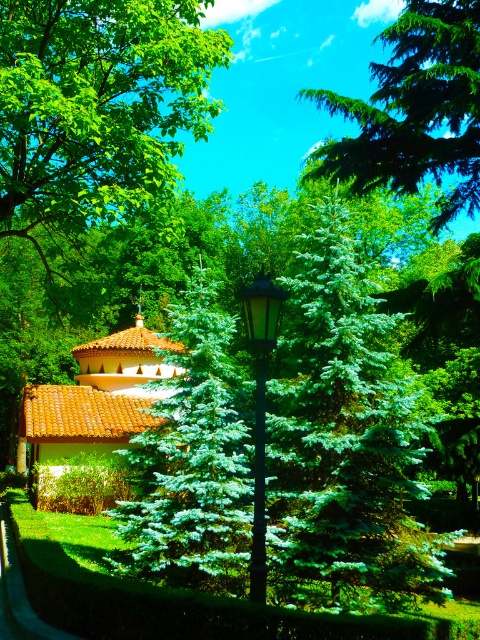
Question: Can you confirm if green needle-like tree at upper center is thinner than green grass at lower left?

Choices:
 (A) no
 (B) yes

Answer: (A)

Question: Is green needle-like tree at upper center wider than green grass at lower left?

Choices:
 (A) no
 (B) yes

Answer: (B)

Question: Is green needle-like tree at upper center positioned behind green grass at lower left?

Choices:
 (A) no
 (B) yes

Answer: (B)